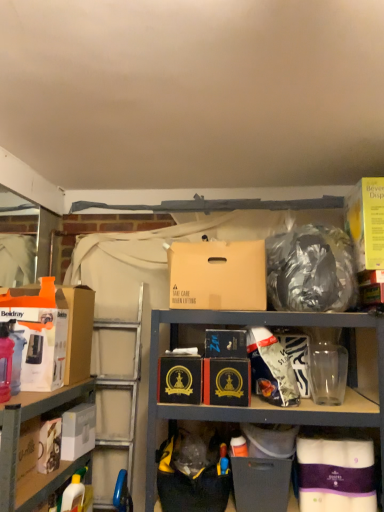
From the picture: What is the approximate height of yellow plastic bottle at lower left?

The height of yellow plastic bottle at lower left is 10.39 inches.

The image size is (384, 512). Describe the element at coordinates (179, 379) in the screenshot. I see `black cardboard box at center, which appears as the 7th box when viewed from the right` at that location.

This screenshot has height=512, width=384. I want to click on black plastic bag at lower center, acting as the 2th garbage starting from the top, so click(x=192, y=473).

What do you see at coordinates (311, 270) in the screenshot? I see `shiny metallic bag at upper right, which is the 1th garbage from top to bottom` at bounding box center [311, 270].

What do you see at coordinates (227, 382) in the screenshot? This screenshot has height=512, width=384. I see `black cardboard box at center, positioned as the sixth box in left-to-right order` at bounding box center [227, 382].

Image resolution: width=384 pixels, height=512 pixels. What do you see at coordinates (78, 431) in the screenshot?
I see `white matte box at lower left, which is counted as the 2th box, starting from the left` at bounding box center [78, 431].

In order to face white cardboard box at lower left, should I rotate leftwards or rightwards?

To align with it, rotate left about 22.912°.

What are the coordinates of `yellow plastic bottle at lower left` in the screenshot? It's located at (74, 493).

Could you tell me if white matte box at lower left, which is counted as the 2th box, starting from the left, is turned towards orange cardboard box at left, the 1th box from the left?

No, white matte box at lower left, which is counted as the 2th box, starting from the left, is not aimed at orange cardboard box at left, the 1th box from the left.

Based on the photo, how distant is white matte box at lower left, which is counted as the 2th box, starting from the left, from orange cardboard box at left, the ninth box viewed from the right?

white matte box at lower left, which is counted as the 2th box, starting from the left, and orange cardboard box at left, the ninth box viewed from the right, are 34.38 centimeters apart.

Are white matte box at lower left, the eighth box viewed from the right, and orange cardboard box at left, the 1th box from the left, making contact?

No.

Consider the image. From the image's perspective, is white matte box at lower left, which is counted as the 2th box, starting from the left, located beneath orange cardboard box at left, the 1th box from the left?

Yes, from the image's perspective, white matte box at lower left, which is counted as the 2th box, starting from the left, is below orange cardboard box at left, the 1th box from the left.

Is yellow cardboard beverage dispenser at upper right, which ranks as the 9th box in left-to-right order, inside the boundaries of black cardboard box at center, which ranks as the 4th box in right-to-left order, or outside?

The correct answer is: outside.

Is yellow cardboard beverage dispenser at upper right, which ranks as the 9th box in left-to-right order, facing towards black cardboard box at center, which ranks as the 4th box in right-to-left order?

No, yellow cardboard beverage dispenser at upper right, which ranks as the 9th box in left-to-right order, is not aimed at black cardboard box at center, which ranks as the 4th box in right-to-left order.

From a real-world perspective, is yellow cardboard beverage dispenser at upper right, which appears as the 1th box when viewed from the right, physically located above or below black cardboard box at center, which ranks as the 4th box in right-to-left order?

yellow cardboard beverage dispenser at upper right, which appears as the 1th box when viewed from the right, is above black cardboard box at center, which ranks as the 4th box in right-to-left order.

Is yellow cardboard beverage dispenser at upper right, which ranks as the 9th box in left-to-right order, far from black cardboard box at center, positioned as the sixth box in left-to-right order?

That's not correct — yellow cardboard beverage dispenser at upper right, which ranks as the 9th box in left-to-right order, is a little close to black cardboard box at center, positioned as the sixth box in left-to-right order.

Measure the distance between black cardboard box at center, positioned as the sixth box in left-to-right order, and brown cardboard box at center, which is the fourth box in left-to-right order.

black cardboard box at center, positioned as the sixth box in left-to-right order, is 31.81 centimeters away from brown cardboard box at center, which is the fourth box in left-to-right order.

How many degrees apart are the facing directions of black cardboard box at center, which ranks as the 4th box in right-to-left order, and brown cardboard box at center, which is the 6th box in right-to-left order?

black cardboard box at center, which ranks as the 4th box in right-to-left order, and brown cardboard box at center, which is the 6th box in right-to-left order, are facing 2.13 degrees away from each other.

Is black cardboard box at center, positioned as the sixth box in left-to-right order, positioned in front of brown cardboard box at center, which is the fourth box in left-to-right order?

No, it is not.

From their relative heights in the image, would you say black cardboard box at center, positioned as the sixth box in left-to-right order, is taller or shorter than brown cardboard box at center, which is the fourth box in left-to-right order?

In the image, black cardboard box at center, positioned as the sixth box in left-to-right order, appears to be shorter than brown cardboard box at center, which is the fourth box in left-to-right order.

Between yellow plastic bottle at lower left and black cardboard box at center, which ranks as the 4th box in right-to-left order, which one has larger size?

black cardboard box at center, which ranks as the 4th box in right-to-left order.

Can you see yellow plastic bottle at lower left touching black cardboard box at center, positioned as the sixth box in left-to-right order?

No, yellow plastic bottle at lower left is not beside black cardboard box at center, positioned as the sixth box in left-to-right order.

Is the position of yellow plastic bottle at lower left less distant than that of black cardboard box at center, which ranks as the 4th box in right-to-left order?

That is False.

Does yellow plastic bottle at lower left have a greater width compared to black cardboard box at center, which ranks as the 4th box in right-to-left order?

In fact, yellow plastic bottle at lower left might be narrower than black cardboard box at center, which ranks as the 4th box in right-to-left order.

Consider the image. From the image's perspective, between translucent plastic bottle at left and orange cardboard box at left, the ninth box viewed from the right, who is located below?

translucent plastic bottle at left appears lower in the image.

In the image, is translucent plastic bottle at left positioned in front of or behind orange cardboard box at left, the 1th box from the left?

Visually, translucent plastic bottle at left is located in front of orange cardboard box at left, the 1th box from the left.

This screenshot has width=384, height=512. What are the coordinates of `shelf above the yellow plastic bottle at lower left (from the image's perspective)` in the screenshot? It's located at [x=18, y=444].

Based on their positions, is white cardboard box at lower left located to the left or right of yellow plastic bottle at lower left?

white cardboard box at lower left is to the left of yellow plastic bottle at lower left.

From the image's perspective, does white cardboard box at lower left appear lower than yellow plastic bottle at lower left?

No, from the image's perspective, white cardboard box at lower left is not beneath yellow plastic bottle at lower left.

In the scene shown: Is white cardboard box at lower left far away from yellow plastic bottle at lower left?

No.

You are a GUI agent. You are given a task and a screenshot of the screen. Output one action in this format:
    pyautogui.click(x=<x>, y=<y>)
    Task: Click on the cleaning product below the black cardboard box at center, the fifth box when ordered from left to right (from a real-world perspective)
    
    Given the screenshot: What is the action you would take?
    pyautogui.click(x=74, y=493)

Is black cardboard box at center, which appears as the 5th box when viewed from the right, with yellow plastic bottle at lower left?

No.

Considering the relative sizes of black cardboard box at center, the fifth box when ordered from left to right, and yellow plastic bottle at lower left in the image provided, is black cardboard box at center, the fifth box when ordered from left to right, wider than yellow plastic bottle at lower left?

Yes.

Considering the sizes of objects black cardboard box at center, the fifth box when ordered from left to right, and yellow plastic bottle at lower left in the image provided, who is taller, black cardboard box at center, the fifth box when ordered from left to right, or yellow plastic bottle at lower left?

Standing taller between the two is yellow plastic bottle at lower left.

Where is `box to the left of white matte box at lower left, which is counted as the 2th box, starting from the left`? This screenshot has height=512, width=384. box to the left of white matte box at lower left, which is counted as the 2th box, starting from the left is located at coordinates (51, 334).

Where is `the 5th box directly beneath the yellow cardboard beverage dispenser at upper right, which ranks as the 9th box in left-to-right order (from a real-world perspective)`? The height and width of the screenshot is (512, 384). the 5th box directly beneath the yellow cardboard beverage dispenser at upper right, which ranks as the 9th box in left-to-right order (from a real-world perspective) is located at coordinates (227, 382).

From the picture: When comparing their distances from black cardboard box at center, which appears as the 7th box when viewed from the right, does black plastic bag at lower center, acting as the 2th garbage starting from the top, or yellow plastic bottle at lower left seem further?

yellow plastic bottle at lower left.

Estimate the real-world distances between objects in this image. Which object is closer to matte black box at lower center, the 7th box positioned from the left, translucent plastic bottle at left or yellow cardboard beverage dispenser at upper right, which ranks as the 9th box in left-to-right order?

yellow cardboard beverage dispenser at upper right, which ranks as the 9th box in left-to-right order, lies closer to matte black box at lower center, the 7th box positioned from the left, than the other object.

Consider the image. Estimate the real-world distances between objects in this image. Which object is further from yellow plastic bottle at lower left, black cardboard box at center, which appears as the 7th box when viewed from the right, or white cardboard box at lower left?

black cardboard box at center, which appears as the 7th box when viewed from the right, is further to yellow plastic bottle at lower left.

Based on their spatial positions, is white matte toilet paper at lower right, positioned as the second box in right-to-left order, or black cardboard box at center, positioned as the sixth box in left-to-right order, closer to white cardboard box at lower left?

The object closer to white cardboard box at lower left is black cardboard box at center, positioned as the sixth box in left-to-right order.

Estimate the real-world distances between objects in this image. Which object is further from black cardboard box at center, the fifth box when ordered from left to right, white matte toilet paper at lower right, marked as the 8th box in a left-to-right arrangement, or shiny metallic bag at upper right, which is the 1th garbage from top to bottom?

white matte toilet paper at lower right, marked as the 8th box in a left-to-right arrangement.

Looking at the image, which one is located closer to white matte box at lower left, the eighth box viewed from the right, yellow cardboard beverage dispenser at upper right, which ranks as the 9th box in left-to-right order, or black plastic bag at lower center, acting as the 2th garbage starting from the top?

black plastic bag at lower center, acting as the 2th garbage starting from the top, is closer to white matte box at lower left, the eighth box viewed from the right.

Which object lies further to the anchor point yellow cardboard beverage dispenser at upper right, which appears as the 1th box when viewed from the right, shiny metallic bag at upper right, which is the 1th garbage from top to bottom, or matte black box at lower center, the 7th box positioned from the left?

Among the two, matte black box at lower center, the 7th box positioned from the left, is located further to yellow cardboard beverage dispenser at upper right, which appears as the 1th box when viewed from the right.

When comparing their distances from yellow cardboard beverage dispenser at upper right, which appears as the 1th box when viewed from the right, does brown cardboard box at center, which is the 6th box in right-to-left order, or black cardboard box at center, which ranks as the 4th box in right-to-left order, seem closer?

brown cardboard box at center, which is the 6th box in right-to-left order, is closer to yellow cardboard beverage dispenser at upper right, which appears as the 1th box when viewed from the right.

The image size is (384, 512). I want to click on box between yellow plastic bottle at lower left and black plastic bag at lower center, acting as the 2th garbage starting from the right, in the horizontal direction, so click(x=179, y=379).

Where is `garbage between shiny metallic bag at upper right, which is the 1th garbage from top to bottom, and matte black box at lower center, which is the 3th box in right-to-left order, in the vertical direction`? The width and height of the screenshot is (384, 512). garbage between shiny metallic bag at upper right, which is the 1th garbage from top to bottom, and matte black box at lower center, which is the 3th box in right-to-left order, in the vertical direction is located at coordinates (192, 473).

At what (x,y) coordinates should I click in order to perform the action: click on garbage situated between white matte box at lower left, which is counted as the 2th box, starting from the left, and matte black box at lower center, which is the 3th box in right-to-left order, from left to right. Please return your answer as a coordinate pair (x, y). Image resolution: width=384 pixels, height=512 pixels. Looking at the image, I should click on (192, 473).

Locate an element on the screen. The height and width of the screenshot is (512, 384). bottle between white cardboard box at lower left and black cardboard box at center, the fifth box when ordered from left to right, in the horizontal direction is located at coordinates click(5, 362).